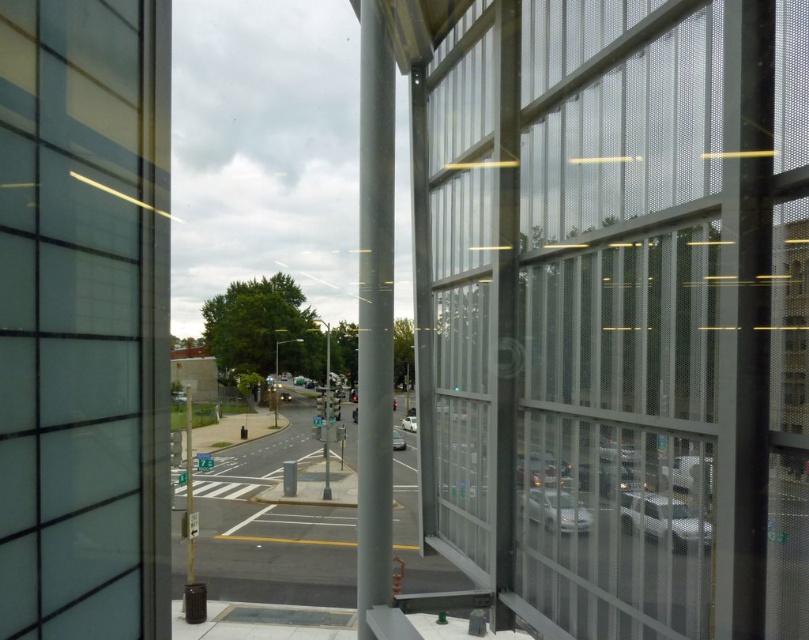
You are standing at the camera position and want to cross the street to reach the white matte car at center. The crosswalk is 30 meters away from you. Can you safely reach the car without crossing the crosswalk?

The distance between you and the white matte car at center is 41.25 meters, which is farther than the crosswalk distance of 30 meters. Therefore, you need to cross the crosswalk to reach the car safely.

You are a delivery person trying to determine if your 3.5 meter wide delivery truck can fit through the space between the clear mesh screen at right and the shiny silver sedan at center. Based on the scene, can you safely navigate through that space?

The clear mesh screen at right is wider than the shiny silver sedan at center. Since the truck is 3.5 meters wide, you need to ensure the space between them is at least that width. However, without knowing the exact distance between the two objects, it is impossible to confirm if the truck can fit safely.

You are a delivery person trying to see the traffic light ahead through the window. You notice the clear mesh screen at right and the shiny silver sedan at center. Which object might block your view of the traffic light more due to its height?

The clear mesh screen at right is much taller than the shiny silver sedan at center, so it would block your view more due to its greater height.